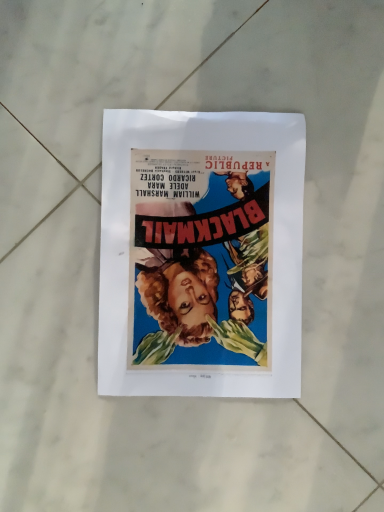
Where is `free point above matte paper poster at center (from a real-world perspective)`? Image resolution: width=384 pixels, height=512 pixels. free point above matte paper poster at center (from a real-world perspective) is located at coordinates (208, 253).